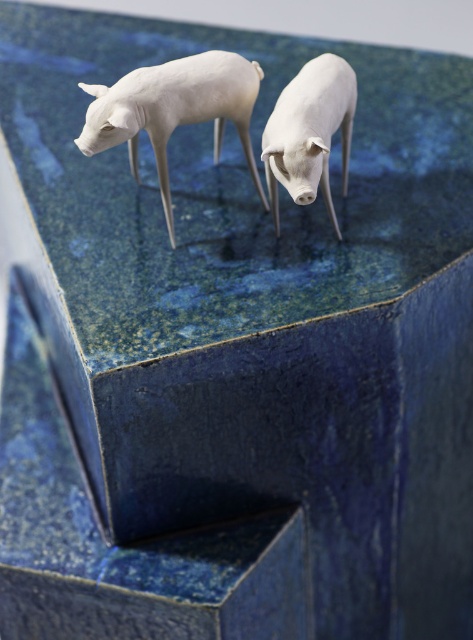
You are a photographer standing at a certain distance from the white matte lamb at center. You want to capture a closeup shot of the lamb. Do you need to move closer or farther away from the lamb?

The white matte lamb at center is 1.25 meters from camera. If you want a closer shot, you need to move closer to the lamb to reduce the distance between the camera and the lamb.

You are an artist trying to place a new sculpture between the white matte lamb at center and the white matte pig at center on the blue surface. Which one should you use as a reference for height to ensure the new sculpture is taller than both?

The white matte lamb at center is much taller than the white matte pig at center, so you should use the white matte lamb at center as the reference to ensure the new sculpture is taller than both.

Looking at this image, you are organizing a display and need to place a small decorative item between the white matte lamb at center and the white matte pig at center. Which animal figurine should the item be closer to if it needs to be placed near the smaller one?

The white matte pig at center is smaller than the white matte lamb at center, so the item should be placed closer to the white matte pig at center.